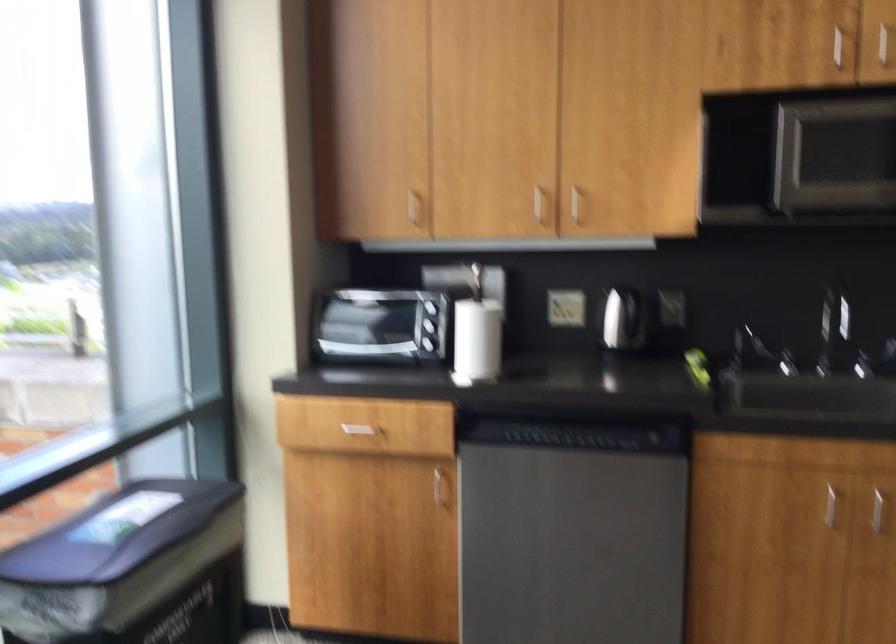
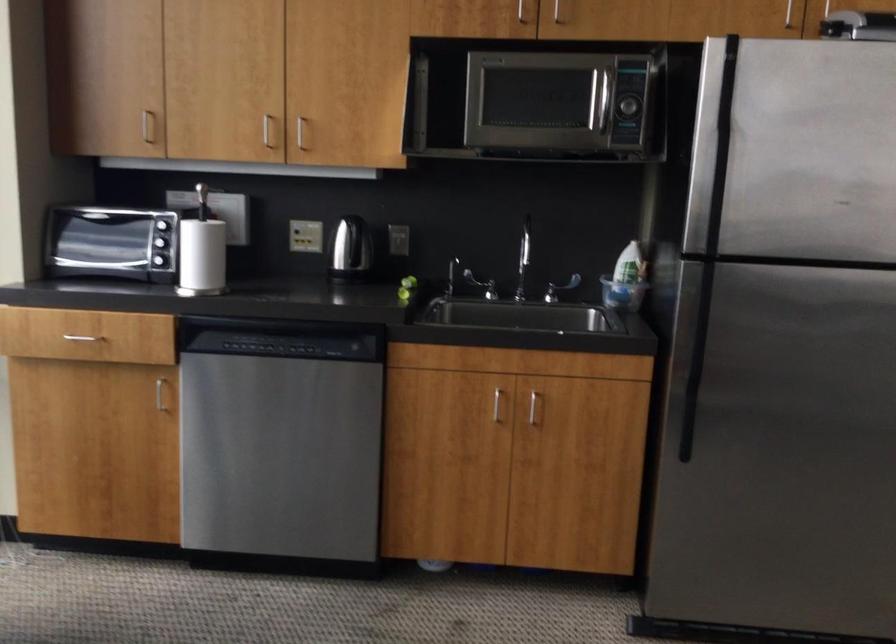
In the second image, find the point that corresponds to point (412, 207) in the first image.

(147, 126)